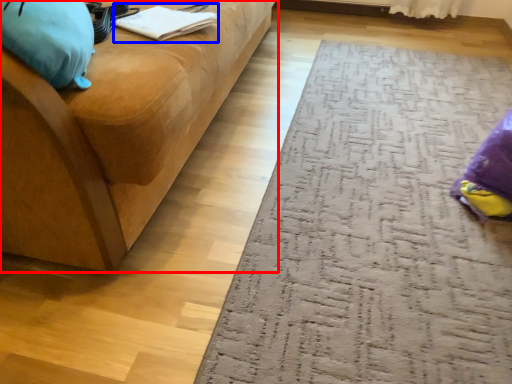
Question: Which point is further to the camera, studio couch (highlighted by a red box) or book (highlighted by a blue box)?

Choices:
 (A) studio couch
 (B) book

Answer: (B)